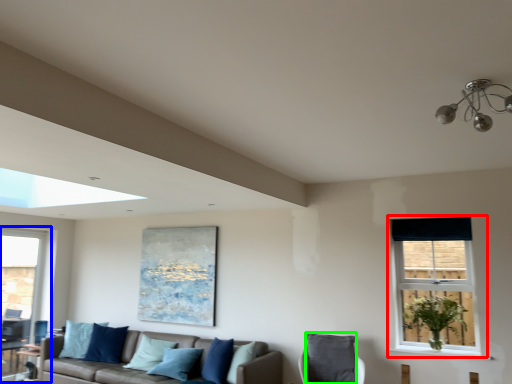
Question: Which object is positioned closest to window (highlighted by a red box)? Select from window (highlighted by a blue box) and pillow (highlighted by a green box).

Choices:
 (A) window
 (B) pillow

Answer: (B)